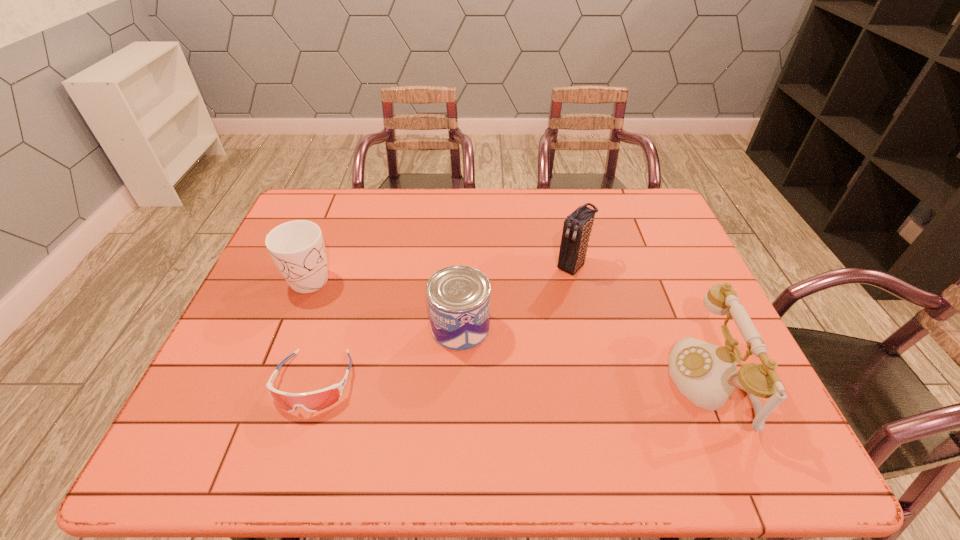
This screenshot has width=960, height=540. I want to click on vacant space on the desktop that is between the goggles and the rightmost object and is positioned on the side of the mug with the handle, so click(x=502, y=382).

Identify the location of vacant spot on the desktop that is between the goggles and the rightmost object and is positioned on the front label of the third object from left to right. Image resolution: width=960 pixels, height=540 pixels. (565, 382).

Find the location of a particular element. The height and width of the screenshot is (540, 960). free spot on the desktop that is between the goggles and the rightmost object and is positioned with the zip open on the clutch bag is located at coordinates point(454,382).